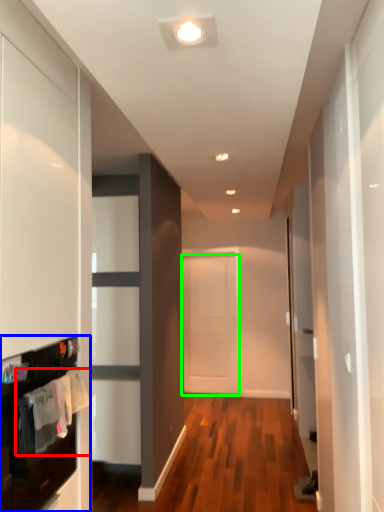
Question: Which object is the farthest from laundry (highlighted by a red box)? Choose among these: cabinetry (highlighted by a blue box) or door (highlighted by a green box).

Choices:
 (A) cabinetry
 (B) door

Answer: (B)